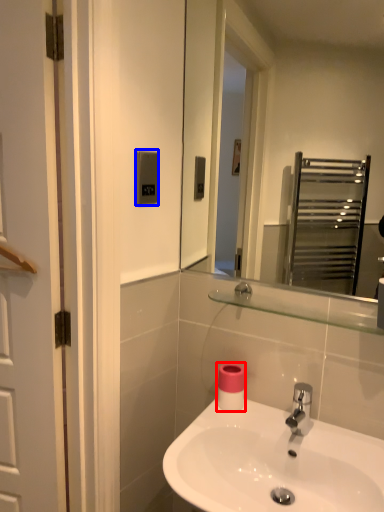
Question: Which object is further to the camera taking this photo, toilet paper (highlighted by a red box) or light switch (highlighted by a blue box)?

Choices:
 (A) toilet paper
 (B) light switch

Answer: (A)